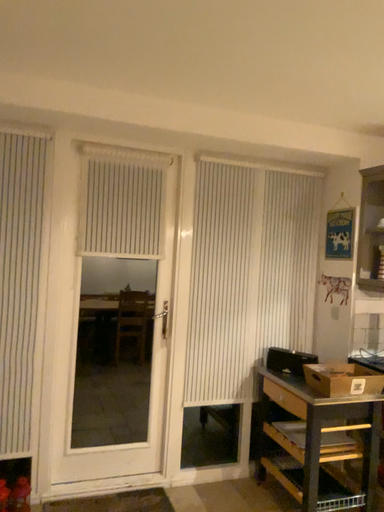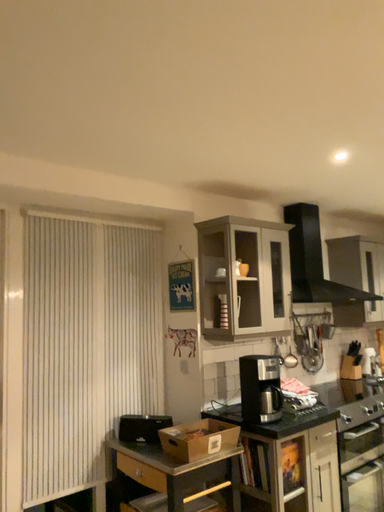
Question: How did the camera likely rotate when shooting the video?

Choices:
 (A) rotated upward
 (B) rotated downward

Answer: (A)